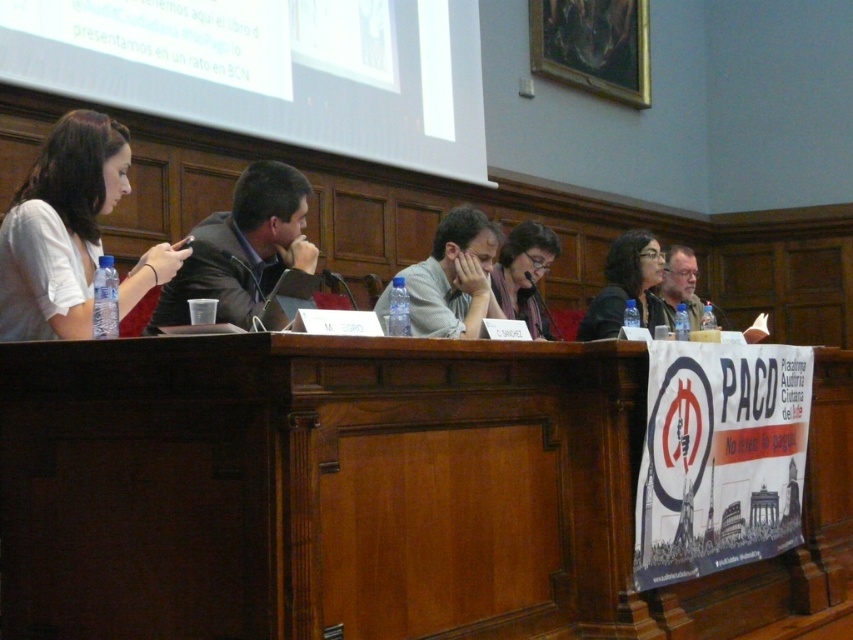
Between point (627, 488) and point (512, 243), which one is positioned behind?

The point (512, 243) is behind.

Does brown wood table at center appear on the right side of matte gray scarf at center?

Indeed, brown wood table at center is positioned on the right side of matte gray scarf at center.

Is point (323, 456) positioned before point (531, 224)?

Yes, point (323, 456) is in front of point (531, 224).

At what (x,y) coordinates should I click in order to perform the action: click on brown wood table at center. Please return your answer as a coordinate pair (x, y). The width and height of the screenshot is (853, 640). Looking at the image, I should click on (366, 492).

Which is above, dark brown suit at center or gray hair at right?

gray hair at right

Is dark brown suit at center thinner than gray hair at right?

Incorrect, dark brown suit at center's width is not less than gray hair at right's.

What do you see at coordinates (242, 250) in the screenshot? I see `dark brown suit at center` at bounding box center [242, 250].

Locate an element on the screen. dark brown suit at center is located at coordinates (242, 250).

Based on the photo, is brown wood table at center wider than dark brown suit at center?

Indeed, brown wood table at center has a greater width compared to dark brown suit at center.

Between brown wood table at center and dark brown suit at center, which one is positioned lower?

brown wood table at center is below.

Measure the distance between point (190,525) and camera.

The distance of point (190,525) from camera is 7.48 feet.

Where is `brown wood table at center`? The image size is (853, 640). brown wood table at center is located at coordinates (366, 492).